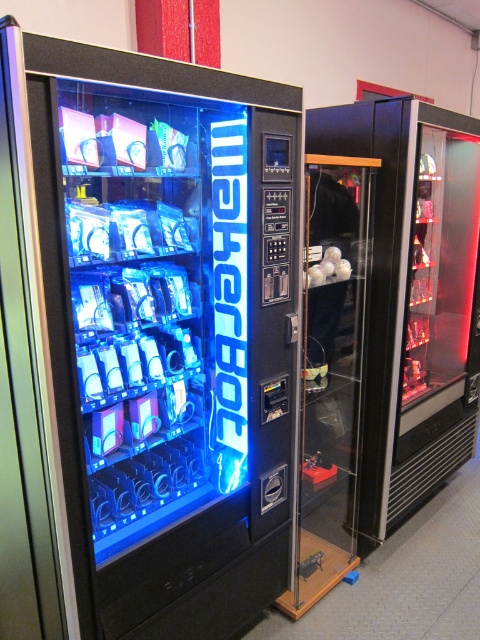
Is matte black vending machine at left bigger than transparent glass beverage dispenser at right?

No, matte black vending machine at left is not bigger than transparent glass beverage dispenser at right.

Is matte black vending machine at left behind transparent glass beverage dispenser at right?

That is False.

Which is behind, point (219, 579) or point (333, 147)?

The point (333, 147) is more distant.

I want to click on matte black vending machine at left, so click(x=162, y=330).